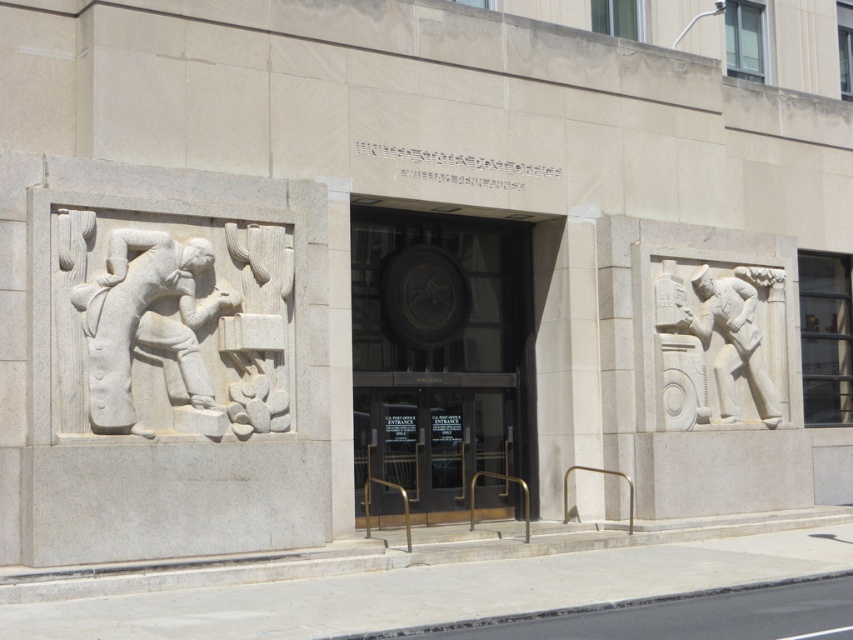
From the picture: Who is positioned more to the right, polished bronze door at center or white stone figure at right?

From the viewer's perspective, white stone figure at right appears more on the right side.

Does point (480, 508) come behind point (718, 369)?

No, (480, 508) is closer to viewer.

At what (x,y) coordinates should I click in order to perform the action: click on polished bronze door at center. Please return your answer as a coordinate pair (x, y). This screenshot has width=853, height=640. Looking at the image, I should click on (439, 360).

Consider the image. How far apart are polished bronze door at center and white stone figure at left?

They are 4.38 meters apart.

Is point (434, 360) positioned behind point (64, 256)?

Yes.

Is point (434, 216) closer to camera compared to point (189, 403)?

No, it is behind (189, 403).

The image size is (853, 640). I want to click on polished bronze door at center, so click(x=439, y=360).

Is white stone figure at left smaller than white stone figure at right?

Correct, white stone figure at left occupies less space than white stone figure at right.

I want to click on white stone figure at left, so click(146, 323).